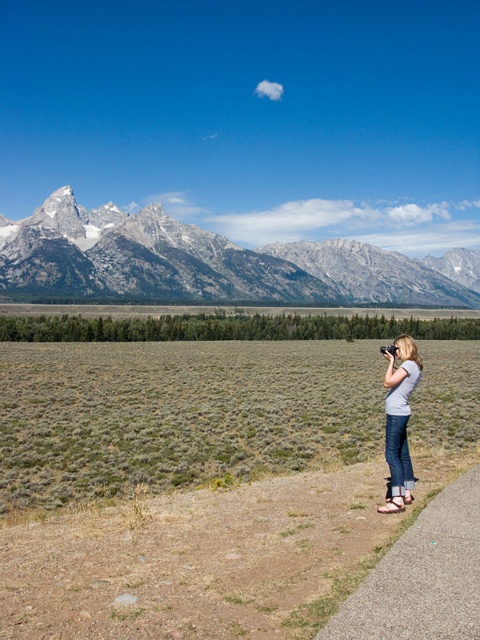
Can you confirm if white rocky mountain range at upper left is smaller than gray cotton shirt at right?

No.

Where is `white rocky mountain range at upper left`? The width and height of the screenshot is (480, 640). white rocky mountain range at upper left is located at coordinates (204, 262).